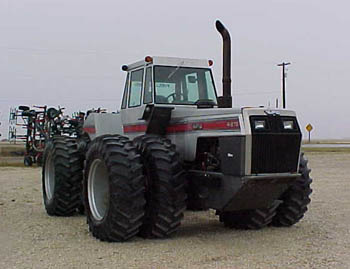
I want to click on window, so click(171, 86), click(123, 99), click(135, 94), click(144, 97), click(175, 90), click(189, 90), click(211, 89).